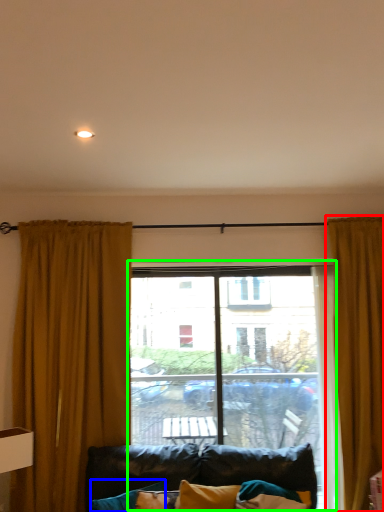
Question: Which is farther away from curtain (highlighted by a red box)? pillow (highlighted by a blue box) or window (highlighted by a green box)?

Choices:
 (A) pillow
 (B) window

Answer: (A)